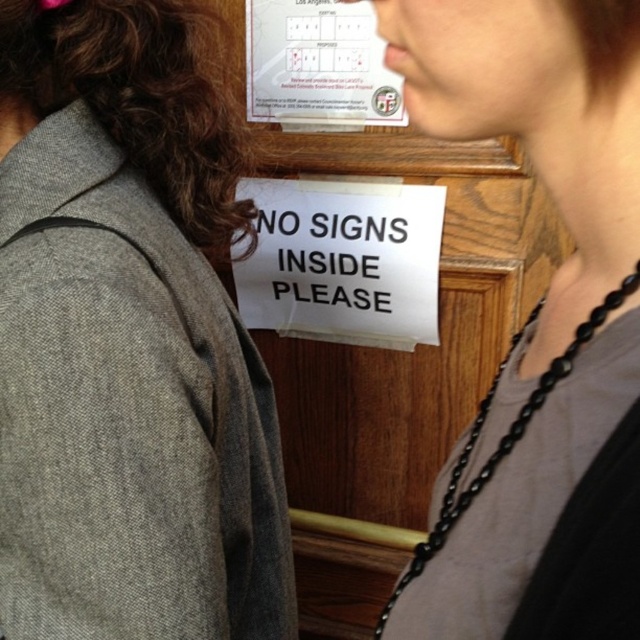
Question: Which point appears closest to the camera in this image?

Choices:
 (A) (225, 228)
 (B) (426, 212)
 (C) (296, 60)
 (D) (241, 454)

Answer: (D)

Question: Which object appears closest to the camera in this image?

Choices:
 (A) matte black necklace at upper right
 (B) brown curly hair at upper left
 (C) white paper poster at upper center

Answer: (A)

Question: Observing the image, what is the correct spatial positioning of brown curly hair at upper left in reference to white paper sign at center?

Choices:
 (A) below
 (B) above

Answer: (B)

Question: Estimate the real-world distances between objects in this image. Which object is closer to the white paper sign at center?

Choices:
 (A) brown curly hair at upper left
 (B) gray woolen jacket at left

Answer: (A)

Question: Is the position of brown curly hair at upper left less distant than that of white paper sign at center?

Choices:
 (A) no
 (B) yes

Answer: (B)

Question: Does gray woolen jacket at left have a smaller size compared to brown curly hair at upper left?

Choices:
 (A) no
 (B) yes

Answer: (A)